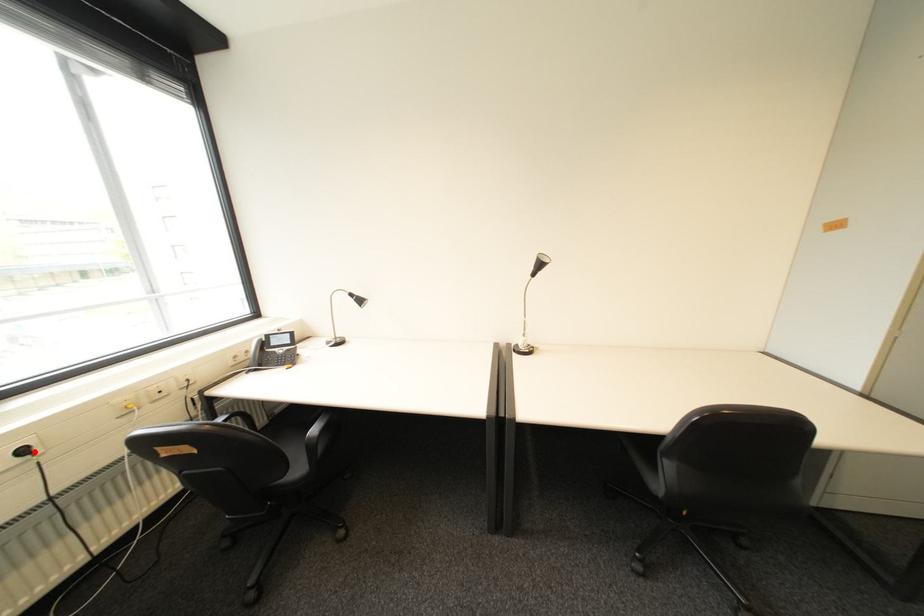
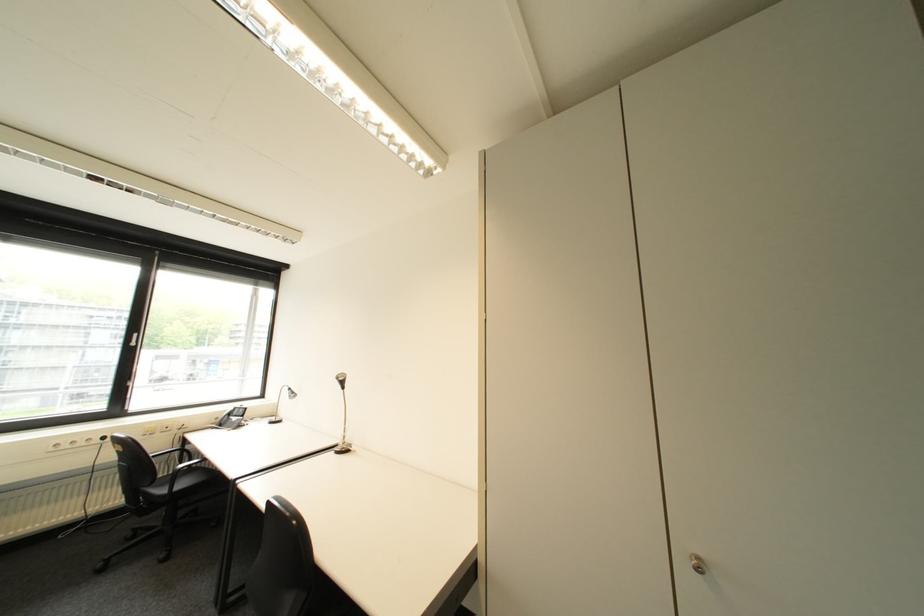
The point at the highlighted location is marked in the first image. Where is the corresponding point in the second image?

(114, 439)